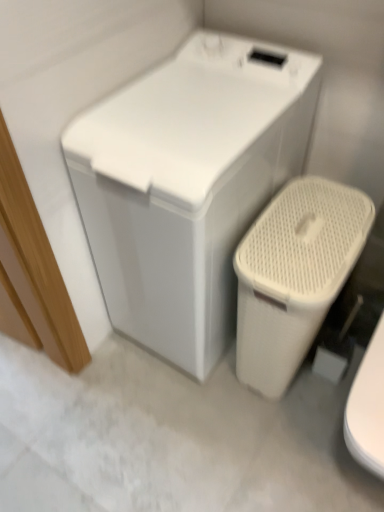
This screenshot has width=384, height=512. What are the coordinates of `free area in between white matte washing machine at upper center and beige textured plastic toilet at lower right` in the screenshot? It's located at (235, 397).